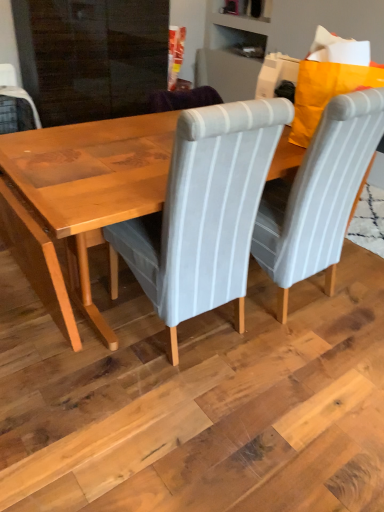
Where is `free space in front of light gray fabric chair at center, the 1th chair positioned from the left`? free space in front of light gray fabric chair at center, the 1th chair positioned from the left is located at coordinates (163, 406).